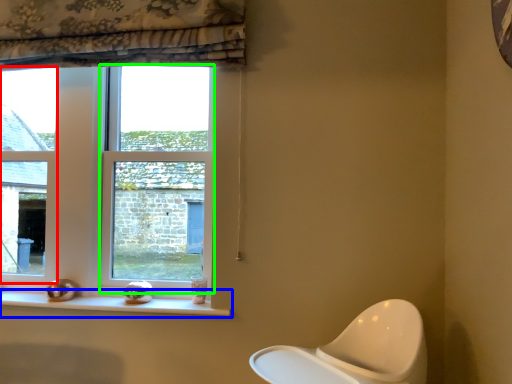
Question: Based on their relative distances, which object is farther from window (highlighted by a red box)? Choose from window sill (highlighted by a blue box) and window (highlighted by a green box).

Choices:
 (A) window sill
 (B) window

Answer: (A)